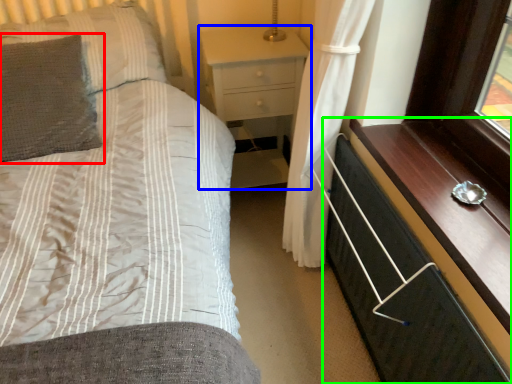
Question: Considering the real-world distances, which object is farthest from pillow (highlighted by a red box)? nightstand (highlighted by a blue box) or chest of drawers (highlighted by a green box)?

Choices:
 (A) nightstand
 (B) chest of drawers

Answer: (B)